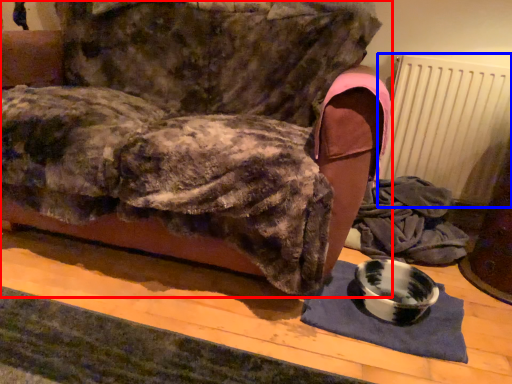
Question: Which object appears farthest to the camera in this image, furniture (highlighted by a red box) or radiator (highlighted by a blue box)?

Choices:
 (A) furniture
 (B) radiator

Answer: (B)